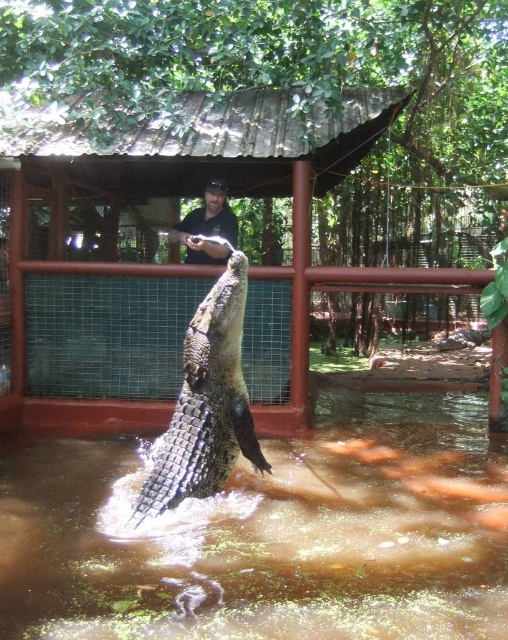
You are a visitor at the sanctuary and want to take a photo of the shiny brown crocodile at center without including the black matte shirt at upper center in the frame. Is it possible to do so based on their positions?

The shiny brown crocodile at center is in front of the black matte shirt at upper center, so it is possible to take a photo of the shiny brown crocodile at center without including the black matte shirt at upper center by focusing on the crocodile and ensuring the shirt is out of the frame.

You are a visitor at the sanctuary and want to take a photo of the black matte shirt at upper center and the brown murky water at center. Which object should you focus on first if you want both to be in sharp focus?

You should focus on the black matte shirt at upper center first because it is farther from the viewer than the brown murky water at center, so adjusting focus from the farther object to the closer one will ensure both are sharp.

You are a zookeeper who needs to ensure the safety of the visitors. The shiny brown crocodile at center and the black matte shirt at upper center are both visible in the enclosure. Which object is wider in this scene?

The shiny brown crocodile at center is wider than the black matte shirt at upper center.